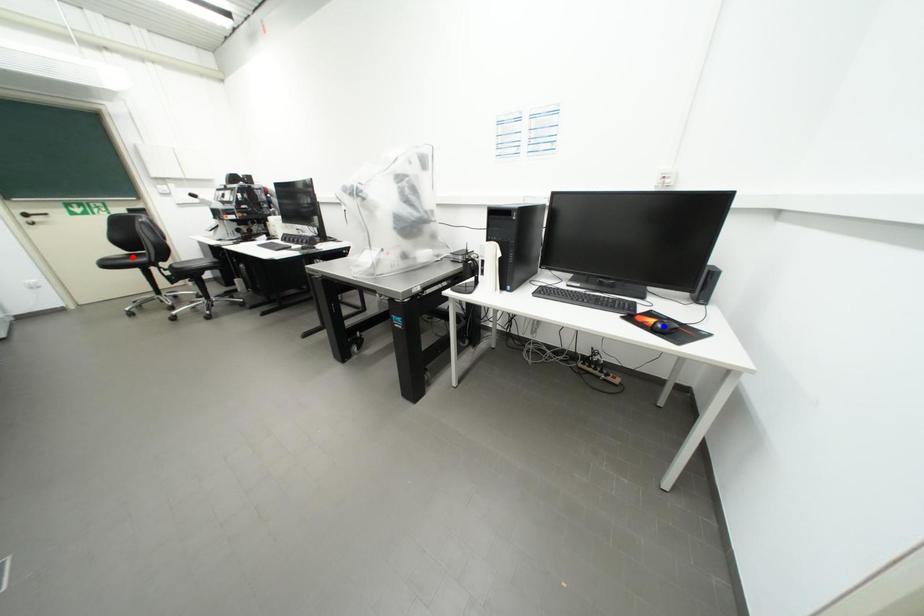
Question: In the image, two points are highlighted. Which point is nearer to the camera? Reply with the corresponding letter.

Choices:
 (A) blue point
 (B) red point

Answer: (A)